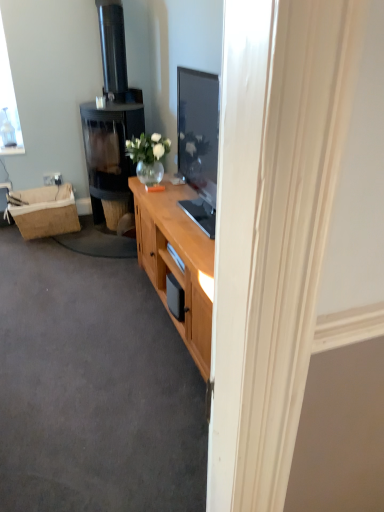
Question: From the image's perspective, does black glass fireplace at left appear higher than wooden cabinet at center?

Choices:
 (A) yes
 (B) no

Answer: (A)

Question: Can you confirm if black glass fireplace at left is shorter than wooden cabinet at center?

Choices:
 (A) yes
 (B) no

Answer: (B)

Question: From a real-world perspective, is black glass fireplace at left positioned under wooden cabinet at center based on gravity?

Choices:
 (A) no
 (B) yes

Answer: (A)

Question: Considering the relative sizes of black glass fireplace at left and wooden cabinet at center in the image provided, is black glass fireplace at left taller than wooden cabinet at center?

Choices:
 (A) no
 (B) yes

Answer: (B)

Question: Can we say black glass fireplace at left lies outside wooden cabinet at center?

Choices:
 (A) no
 (B) yes

Answer: (B)

Question: From the image's perspective, relative to black glass fireplace at left, is wooden cabinet at center above or below?

Choices:
 (A) above
 (B) below

Answer: (B)

Question: From their relative heights in the image, would you say wooden cabinet at center is taller or shorter than black glass fireplace at left?

Choices:
 (A) short
 (B) tall

Answer: (A)

Question: From a real-world perspective, relative to black glass fireplace at left, is wooden cabinet at center vertically above or below?

Choices:
 (A) below
 (B) above

Answer: (A)

Question: Is wooden cabinet at center bigger or smaller than black glass fireplace at left?

Choices:
 (A) small
 (B) big

Answer: (A)

Question: In terms of width, does burlap picnic basket at left look wider or thinner when compared to wooden cabinet at center?

Choices:
 (A) thin
 (B) wide

Answer: (A)

Question: Is burlap picnic basket at left taller or shorter than wooden cabinet at center?

Choices:
 (A) tall
 (B) short

Answer: (A)

Question: Is burlap picnic basket at left to the left or to the right of wooden cabinet at center in the image?

Choices:
 (A) right
 (B) left

Answer: (B)

Question: Choose the correct answer: Is burlap picnic basket at left inside wooden cabinet at center or outside it?

Choices:
 (A) inside
 (B) outside

Answer: (B)

Question: Is point (117, 146) closer or farther from the camera than point (92, 402)?

Choices:
 (A) closer
 (B) farther

Answer: (B)

Question: From the image's perspective, is black glass fireplace at left above or below wooden cabinet at center?

Choices:
 (A) above
 (B) below

Answer: (A)